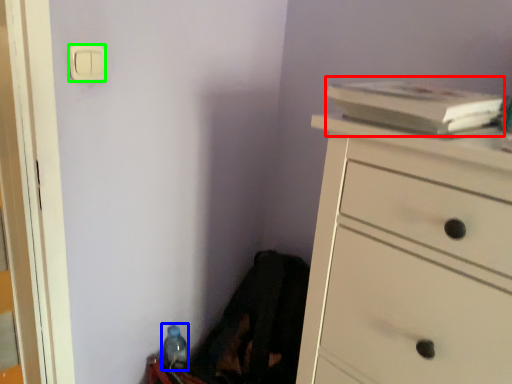
Question: Estimate the real-world distances between objects in this image. Which object is closer to book (highlighted by a red box), bottle (highlighted by a blue box) or light switch (highlighted by a green box)?

Choices:
 (A) bottle
 (B) light switch

Answer: (B)